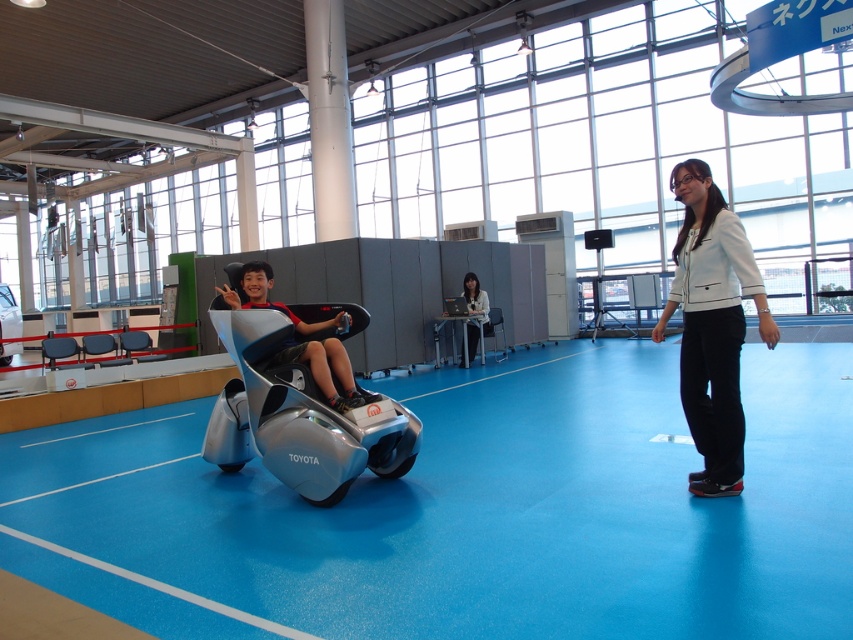
Between silver metallic mobility scooter at center and white matte jacket at center, which one is positioned lower?

silver metallic mobility scooter at center

Is the position of silver metallic mobility scooter at center less distant than that of white matte jacket at center?

No, silver metallic mobility scooter at center is behind white matte jacket at center.

Who is more distant from viewer, (380,416) or (718,280)?

The point (380,416) is behind.

Where is `silver metallic mobility scooter at center`? silver metallic mobility scooter at center is located at coordinates (300, 396).

Which is more to the right, silver metallic mobility scooter at center or silver metallic car at center?

Positioned to the right is silver metallic mobility scooter at center.

Which is below, silver metallic mobility scooter at center or silver metallic car at center?

silver metallic mobility scooter at center

Which is behind, point (335, 461) or point (308, 356)?

Positioned behind is point (308, 356).

Locate an element on the screen. The image size is (853, 640). silver metallic mobility scooter at center is located at coordinates (300, 396).

This screenshot has height=640, width=853. I want to click on silver metallic mobility scooter at center, so click(300, 396).

Looking at this image, who is higher up, silver metallic mobility scooter at center or white fabric jacket at center?

Positioned higher is white fabric jacket at center.

Is point (311, 310) behind point (463, 291)?

No, (311, 310) is closer to viewer.

This screenshot has width=853, height=640. Find the location of `silver metallic mobility scooter at center`. silver metallic mobility scooter at center is located at coordinates (300, 396).